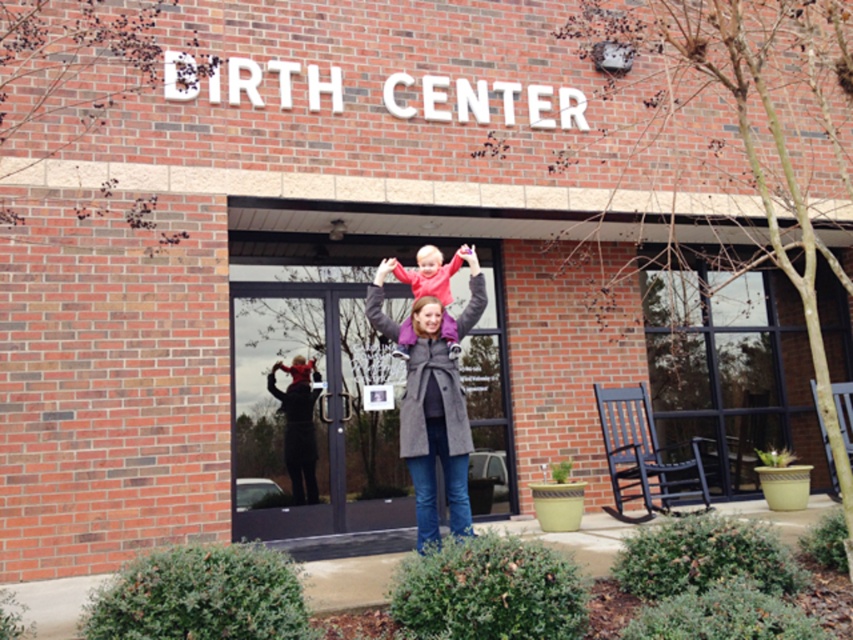
Question: Is transparent glass door at center in front of matte gray coat at center?

Choices:
 (A) yes
 (B) no

Answer: (B)

Question: Among these objects, which one is farthest from the camera?

Choices:
 (A) matte pink sweater at center
 (B) transparent glass door at center

Answer: (B)

Question: Does transparent glass door at center have a larger size compared to matte pink sweater at center?

Choices:
 (A) yes
 (B) no

Answer: (A)

Question: Which object appears farthest from the camera in this image?

Choices:
 (A) matte pink sweater at center
 (B) transparent glass door at center

Answer: (B)

Question: Does transparent glass door at center come behind matte gray coat at center?

Choices:
 (A) no
 (B) yes

Answer: (B)

Question: Which of the following is the farthest from the observer?

Choices:
 (A) (450, 476)
 (B) (625, 416)
 (C) (433, 294)
 (D) (254, 464)

Answer: (B)